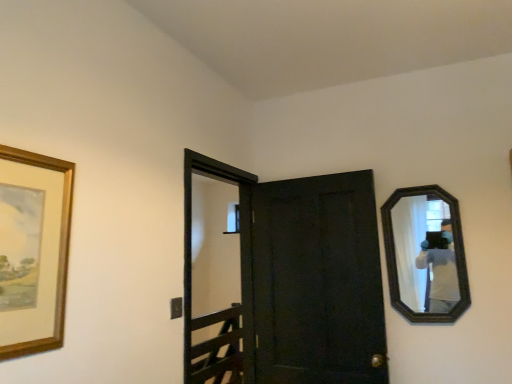
This screenshot has height=384, width=512. In order to click on wooden picture frame at left in this screenshot , I will do `click(33, 250)`.

Describe the element at coordinates (423, 253) in the screenshot. I see `dark wood mirror at right` at that location.

Image resolution: width=512 pixels, height=384 pixels. What are the coordinates of `matte black door at center` in the screenshot? It's located at (296, 282).

Between dark wood mirror at right and wooden picture frame at left, which one has less height?

With less height is wooden picture frame at left.

Considering the positions of point (401, 244) and point (66, 198), is point (401, 244) closer or farther from the camera than point (66, 198)?

Point (401, 244).

Is dark wood mirror at right in front of or behind wooden picture frame at left in the image?

In the image, dark wood mirror at right appears behind wooden picture frame at left.

Does matte black door at center have a greater width compared to dark wood mirror at right?

Correct, the width of matte black door at center exceeds that of dark wood mirror at right.

Who is shorter, matte black door at center or dark wood mirror at right?

Standing shorter between the two is dark wood mirror at right.

Which of these two, matte black door at center or dark wood mirror at right, is bigger?

Bigger between the two is matte black door at center.

Is there a large distance between matte black door at center and dark wood mirror at right?

Actually, matte black door at center and dark wood mirror at right are a little close together.

Is black wooden screen door at center inside or outside of dark wood mirror at right?

black wooden screen door at center is located beyond the bounds of dark wood mirror at right.

Considering the positions of points (189, 305) and (412, 302), is point (189, 305) closer to camera compared to point (412, 302)?

Yes, point (189, 305) is closer to viewer.

Considering the sizes of black wooden screen door at center and dark wood mirror at right in the image, is black wooden screen door at center bigger or smaller than dark wood mirror at right?

Considering their sizes, black wooden screen door at center takes up more space than dark wood mirror at right.

Locate an element on the screen. The height and width of the screenshot is (384, 512). screen door lying below the dark wood mirror at right (from the image's perspective) is located at coordinates (233, 303).

Does dark wood mirror at right turn towards matte black door at center?

No, dark wood mirror at right is not turned towards matte black door at center.

I want to click on mirror lying above the matte black door at center (from the image's perspective), so click(423, 253).

Can you confirm if dark wood mirror at right is wider than matte black door at center?

No.

Is dark wood mirror at right with matte black door at center?

No, dark wood mirror at right is not next to matte black door at center.

From a real-world perspective, is wooden picture frame at left below dark wood mirror at right?

Incorrect, from a real-world perspective, wooden picture frame at left is higher than dark wood mirror at right.

Is wooden picture frame at left outside of dark wood mirror at right?

Absolutely, wooden picture frame at left is external to dark wood mirror at right.

In terms of height, does wooden picture frame at left look taller or shorter compared to dark wood mirror at right?

In the image, wooden picture frame at left appears to be shorter than dark wood mirror at right.

Does wooden picture frame at left have a greater width compared to dark wood mirror at right?

In fact, wooden picture frame at left might be narrower than dark wood mirror at right.

Does point (34, 170) appear closer or farther from the camera than point (242, 240)?

Clearly, point (34, 170) is closer to the camera than point (242, 240).

Is wooden picture frame at left oriented towards black wooden screen door at center?

No, wooden picture frame at left is not turned towards black wooden screen door at center.

Between wooden picture frame at left and black wooden screen door at center, which one has smaller width?

With smaller width is wooden picture frame at left.

Does black wooden screen door at center turn towards matte black door at center?

Yes, black wooden screen door at center is aimed at matte black door at center.

Would you say black wooden screen door at center is a long distance from matte black door at center?

Indeed, black wooden screen door at center is not near matte black door at center.

Is point (232, 346) positioned after point (307, 235)?

Yes, it is behind point (307, 235).

Considering the relative sizes of black wooden screen door at center and matte black door at center in the image provided, is black wooden screen door at center bigger than matte black door at center?

Yes.

Image resolution: width=512 pixels, height=384 pixels. I want to click on mirror on the right of wooden picture frame at left, so click(423, 253).

Identify the location of door that appears below the dark wood mirror at right (from a real-world perspective). (296, 282).

Considering their positions, is dark wood mirror at right positioned further to black wooden screen door at center than matte black door at center?

Based on the image, dark wood mirror at right appears to be further to black wooden screen door at center.

Which object lies nearer to the anchor point wooden picture frame at left, black wooden screen door at center or dark wood mirror at right?

Based on the image, dark wood mirror at right appears to be nearer to wooden picture frame at left.

Looking at the image, which one is located closer to wooden picture frame at left, dark wood mirror at right or matte black door at center?

Based on the image, matte black door at center appears to be nearer to wooden picture frame at left.

From the image, which object appears to be nearer to black wooden screen door at center, matte black door at center or dark wood mirror at right?

Based on the image, matte black door at center appears to be nearer to black wooden screen door at center.

Looking at the image, which one is located closer to matte black door at center, dark wood mirror at right or black wooden screen door at center?

dark wood mirror at right is positioned closer to the anchor matte black door at center.

When comparing their distances from dark wood mirror at right, does wooden picture frame at left or matte black door at center seem further?

wooden picture frame at left is further to dark wood mirror at right.

From the image, which object appears to be nearer to matte black door at center, black wooden screen door at center or wooden picture frame at left?

Based on the image, black wooden screen door at center appears to be nearer to matte black door at center.

Based on their spatial positions, is wooden picture frame at left or black wooden screen door at center closer to dark wood mirror at right?

Based on the image, black wooden screen door at center appears to be nearer to dark wood mirror at right.

I want to click on screen door between wooden picture frame at left and dark wood mirror at right from left to right, so click(233, 303).

At what (x,y) coordinates should I click in order to perform the action: click on door situated between wooden picture frame at left and dark wood mirror at right from left to right. Please return your answer as a coordinate pair (x, y). Looking at the image, I should click on (296, 282).

The image size is (512, 384). In order to click on screen door positioned between wooden picture frame at left and matte black door at center from near to far in this screenshot , I will do `click(233, 303)`.

You are a GUI agent. You are given a task and a screenshot of the screen. Output one action in this format:
    pyautogui.click(x=<x>, y=<y>)
    Task: Click on the door located between black wooden screen door at center and dark wood mirror at right in the left-right direction
    
    Given the screenshot: What is the action you would take?
    pyautogui.click(x=296, y=282)